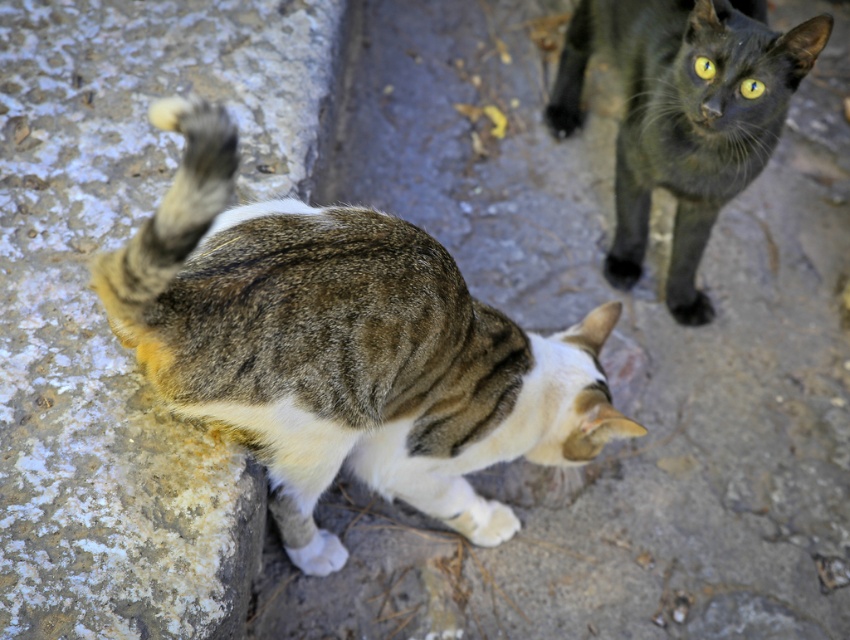
Question: Observing the image, what is the correct spatial positioning of rusty concrete stone at lower left in reference to tabby fur cat at lower left?

Choices:
 (A) left
 (B) right

Answer: (A)

Question: Considering the real-world distances, which object is closest to the tabby fur cat at lower left?

Choices:
 (A) rusty concrete stone at lower left
 (B) shiny black cat at upper right

Answer: (A)

Question: Which object is positioned farthest from the rusty concrete stone at lower left?

Choices:
 (A) tabby fur cat at lower left
 (B) shiny black cat at upper right

Answer: (B)

Question: Is the position of rusty concrete stone at lower left less distant than that of tabby fur cat at lower left?

Choices:
 (A) no
 (B) yes

Answer: (A)

Question: Considering the real-world distances, which object is closest to the tabby fur cat at lower left?

Choices:
 (A) rusty concrete stone at lower left
 (B) shiny black cat at upper right

Answer: (A)

Question: Does rusty concrete stone at lower left appear under tabby fur cat at lower left?

Choices:
 (A) yes
 (B) no

Answer: (B)